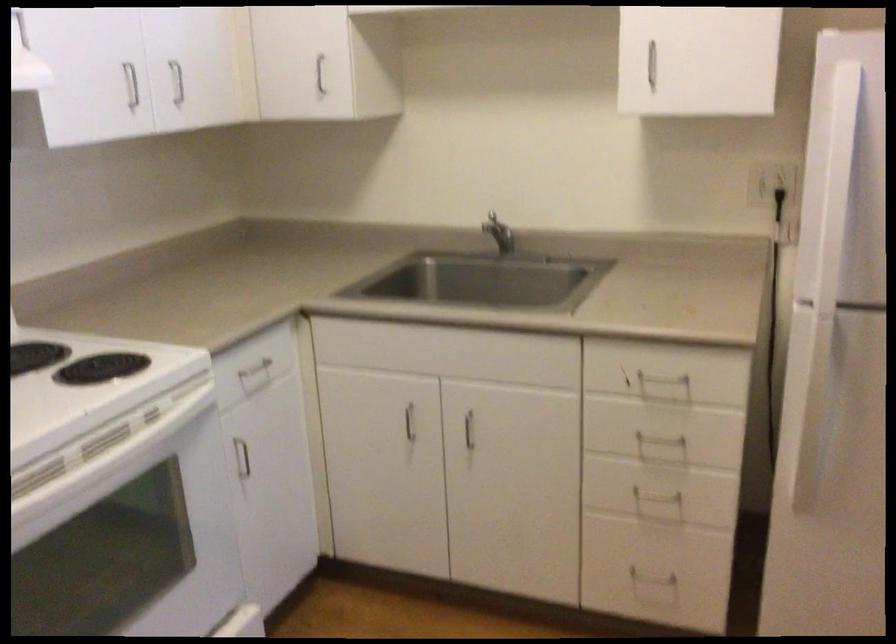
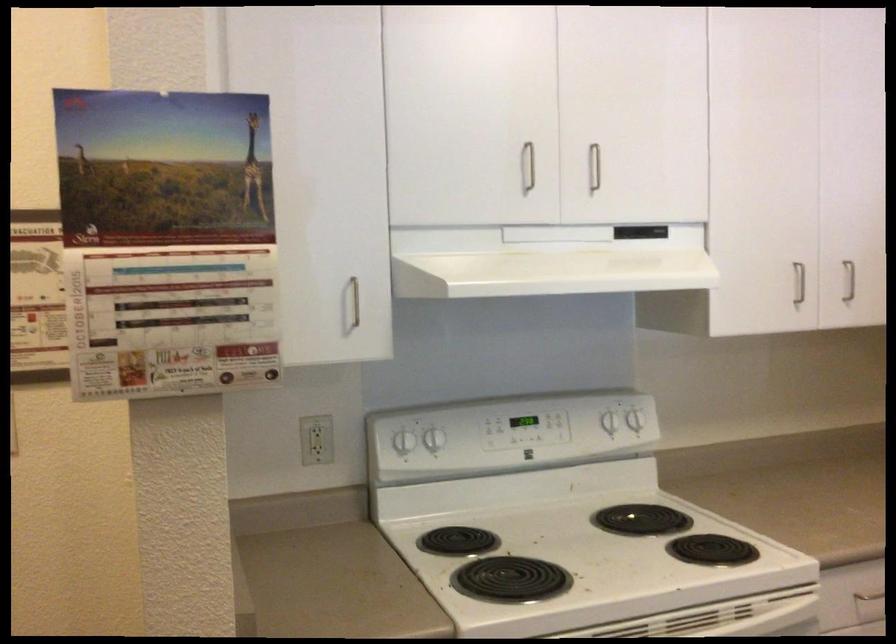
Locate, in the second image, the point that corresponds to (124,82) in the first image.

(798, 283)